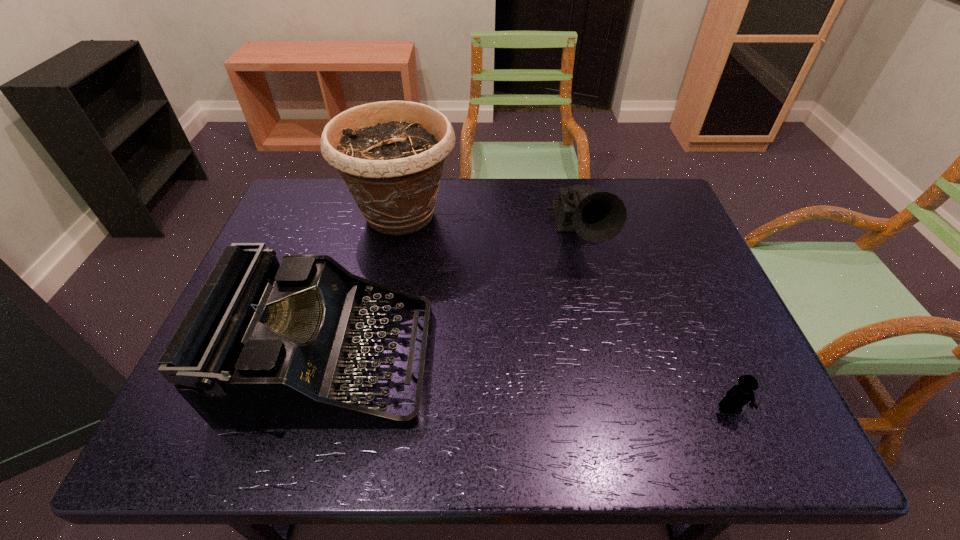
Identify which object is located as the third nearest to the third object from left to right. Please provide its 2D coordinates. Your answer should be formatted as a tuple, i.e. [(x, y)], where the tuple contains the x and y coordinates of a point satisfying the conditions above.

[(739, 395)]

Find the location of a particular element. This screenshot has height=540, width=960. vacant position in the image that satisfies the following two spatial constraints: 1. from the horn of the phonograph_record; 2. on the typing side of the typewriter is located at coordinates pos(610,362).

This screenshot has height=540, width=960. In order to click on vacant space that satisfies the following two spatial constraints: 1. on the front side of the flowerpot; 2. on the typing side of the typewriter in this screenshot , I will do `click(372, 362)`.

Where is `free space that satisfies the following two spatial constraints: 1. from the horn of the phonograph_record; 2. on the typing side of the typewriter`? The width and height of the screenshot is (960, 540). free space that satisfies the following two spatial constraints: 1. from the horn of the phonograph_record; 2. on the typing side of the typewriter is located at coordinates (610, 362).